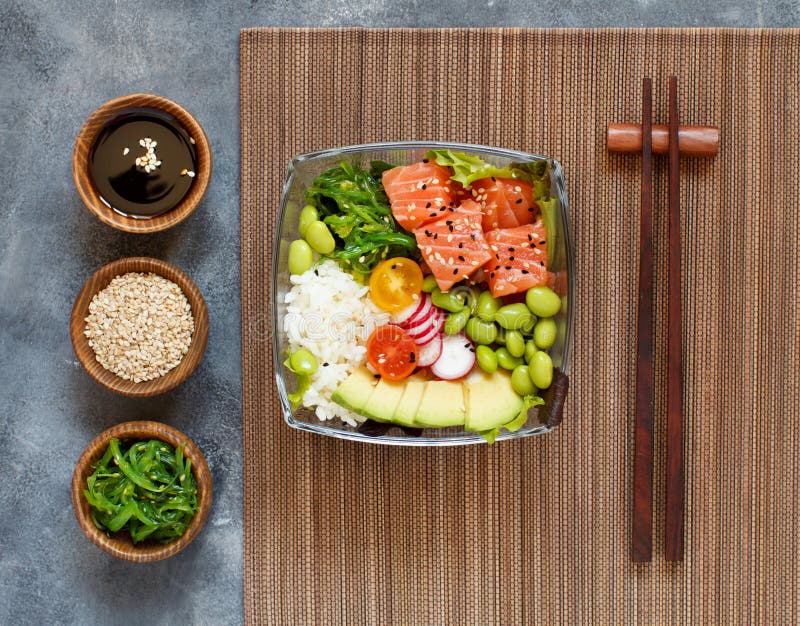
The image size is (800, 626). Find the location of `tabletop`. tabletop is located at coordinates (140, 593).